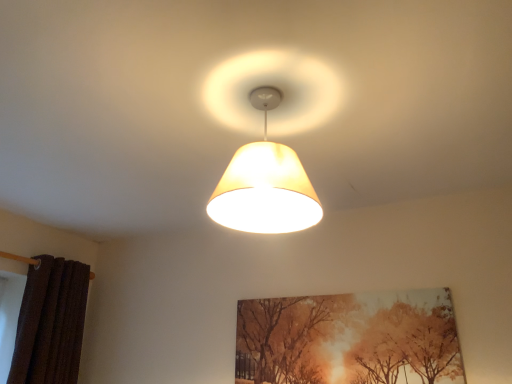
Question: In the image, is matte beige lampshade at center positioned in front of or behind brown textured curtain at left?

Choices:
 (A) behind
 (B) front

Answer: (B)

Question: Which is correct: matte beige lampshade at center is inside brown textured curtain at left, or outside of it?

Choices:
 (A) outside
 (B) inside

Answer: (A)

Question: Based on their relative distances, which object is farther from the brown textured curtain at left?

Choices:
 (A) matte canvas painting at center
 (B) matte beige lampshade at center

Answer: (B)

Question: Estimate the real-world distances between objects in this image. Which object is farther from the matte beige lampshade at center?

Choices:
 (A) brown textured curtain at left
 (B) matte canvas painting at center

Answer: (A)